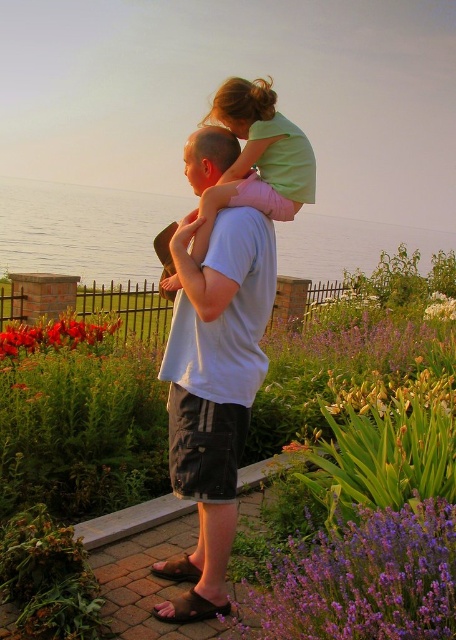
You are trying to take a photo of the white cotton shirt at center and the purple soft lavender at lower right. Which object should you focus on first to ensure both are in the frame?

The white cotton shirt at center is positioned under the purple soft lavender at lower right, so you should focus on the purple soft lavender at lower right first to ensure both are in the frame.